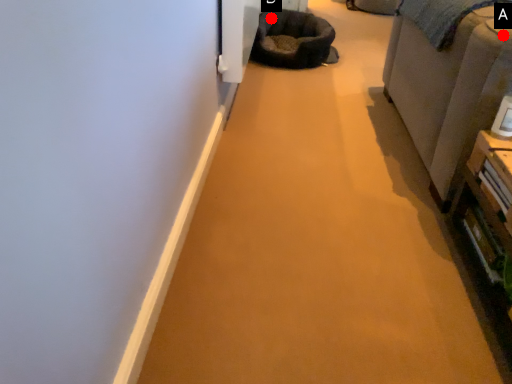
Question: Two points are circled on the image, labeled by A and B beside each circle. Which point is farther to the camera?

Choices:
 (A) A is further
 (B) B is further

Answer: (B)